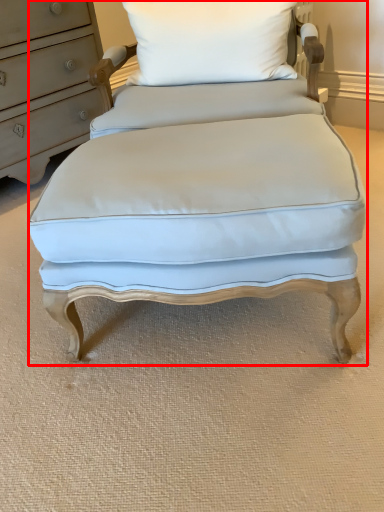
Question: From the image, what is the correct spatial relationship of swivel chair (annotated by the red box) in relation to pillow?

Choices:
 (A) right
 (B) left

Answer: (B)